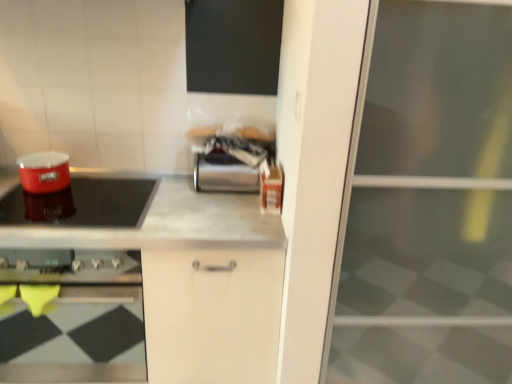
Measure the distance between point [196,325] and camera.

Point [196,325] is 5.15 feet from camera.

Identify the location of transparent glass screen door at right. This screenshot has height=384, width=512. (431, 203).

The image size is (512, 384). I want to click on shiny red pot at left, so click(x=81, y=204).

I want to click on matte black cooktop at left, so [x=77, y=340].

This screenshot has height=384, width=512. I want to click on satin silver canister at center, which ranks as the 2th appliance in left-to-right order, so click(230, 164).

Based on the photo, could you tell me if matte black cooktop at left is turned towards transparent glass screen door at right?

No, matte black cooktop at left is not facing towards transparent glass screen door at right.

Is matte black cooktop at left completely or partially outside of transparent glass screen door at right?

matte black cooktop at left is positioned outside transparent glass screen door at right.

Which of these two, matte black cooktop at left or transparent glass screen door at right, is wider?

transparent glass screen door at right is wider.

At what (x,y) coordinates should I click in order to perform the action: click on home appliance located on the left of transparent glass screen door at right. Please return your answer as a coordinate pair (x, y). Looking at the image, I should click on (77, 340).

The width and height of the screenshot is (512, 384). In order to click on appliance in front of the satin silver canister at center, which is the 1th appliance from right to left in this screenshot , I will do `click(44, 172)`.

Is satin silver canister at center, which is the 1th appliance from right to left, placed right next to matte red pot at left, which is the second appliance from right to left?

No.

Is satin silver canister at center, which is the 1th appliance from right to left, bigger or smaller than matte red pot at left, which ranks as the first appliance in left-to-right order?

Considering their sizes, satin silver canister at center, which is the 1th appliance from right to left, takes up more space than matte red pot at left, which ranks as the first appliance in left-to-right order.

How different are the orientations of satin silver canister at center, which ranks as the 2th appliance in left-to-right order, and matte red pot at left, which ranks as the first appliance in left-to-right order, in degrees?

The angular difference between satin silver canister at center, which ranks as the 2th appliance in left-to-right order, and matte red pot at left, which ranks as the first appliance in left-to-right order, is 0.00412 degrees.

Consider the image. Between matte red pot at left, which is the second appliance from right to left, and satin silver canister at center, which ranks as the 2th appliance in left-to-right order, which one is positioned in front?

matte red pot at left, which is the second appliance from right to left, is in front.

From a real-world perspective, is matte red pot at left, which ranks as the first appliance in left-to-right order, positioned over satin silver canister at center, which ranks as the 2th appliance in left-to-right order, based on gravity?

No, from a real-world perspective, matte red pot at left, which ranks as the first appliance in left-to-right order, is not on top of satin silver canister at center, which ranks as the 2th appliance in left-to-right order.

Would you consider matte red pot at left, which ranks as the first appliance in left-to-right order, to be distant from satin silver canister at center, which ranks as the 2th appliance in left-to-right order?

No, matte red pot at left, which ranks as the first appliance in left-to-right order, is not far from satin silver canister at center, which ranks as the 2th appliance in left-to-right order.

Does satin silver canister at center, which is the 1th appliance from right to left, appear on the left side of shiny red pot at left?

No, satin silver canister at center, which is the 1th appliance from right to left, is not to the left of shiny red pot at left.

Which point is more distant from viewer, (229, 153) or (131, 218)?

Positioned behind is point (229, 153).

From a real-world perspective, is satin silver canister at center, which ranks as the 2th appliance in left-to-right order, on top of shiny red pot at left?

Correct, in the physical world, satin silver canister at center, which ranks as the 2th appliance in left-to-right order, is higher than shiny red pot at left.

Is satin silver canister at center, which is the 1th appliance from right to left, beside shiny red pot at left?

No, satin silver canister at center, which is the 1th appliance from right to left, is not touching shiny red pot at left.

Consider the image. From a real-world perspective, is transparent glass screen door at right above or below matte black cooktop at left?

Clearly, from a real-world perspective, transparent glass screen door at right is above matte black cooktop at left.

From the image's perspective, which one is positioned higher, transparent glass screen door at right or matte black cooktop at left?

From the image's view, transparent glass screen door at right is above.

Which of these two, transparent glass screen door at right or matte black cooktop at left, is wider?

Wider between the two is transparent glass screen door at right.

Is matte black cooktop at left at the back of transparent glass screen door at right?

No, matte black cooktop at left is not at the back of transparent glass screen door at right.

How many degrees apart are the facing directions of shiny red pot at left and transparent glass screen door at right?

The angular difference between shiny red pot at left and transparent glass screen door at right is 0.367 degrees.

Which object is positioned more to the right, shiny red pot at left or transparent glass screen door at right?

transparent glass screen door at right.

Does shiny red pot at left turn towards transparent glass screen door at right?

No, shiny red pot at left is not oriented towards transparent glass screen door at right.

Is point (156, 181) farther from viewer compared to point (443, 185)?

Yes, it is behind point (443, 185).

Is matte black cooktop at left completely or partially outside of satin silver canister at center, which is the 1th appliance from right to left?

Absolutely, matte black cooktop at left is external to satin silver canister at center, which is the 1th appliance from right to left.

Which object is further away from the camera taking this photo, matte black cooktop at left or satin silver canister at center, which is the 1th appliance from right to left?

satin silver canister at center, which is the 1th appliance from right to left, is more distant.

Considering the relative sizes of matte black cooktop at left and satin silver canister at center, which is the 1th appliance from right to left, in the image provided, is matte black cooktop at left taller than satin silver canister at center, which is the 1th appliance from right to left,?

Indeed, matte black cooktop at left has a greater height compared to satin silver canister at center, which is the 1th appliance from right to left.

Is point (65, 352) in front of point (244, 152)?

That is False.

Locate an element on the screen. home appliance below the transparent glass screen door at right (from the image's perspective) is located at coordinates (77, 340).

Find the location of `appliance on the left of the satin silver canister at center, which ranks as the 2th appliance in left-to-right order`. appliance on the left of the satin silver canister at center, which ranks as the 2th appliance in left-to-right order is located at coordinates (44, 172).

Looking at the image, which one is located closer to shiny red pot at left, metallic gray countertop at center or matte red pot at left, which is the second appliance from right to left?

matte red pot at left, which is the second appliance from right to left.

Considering their positions, is satin silver canister at center, which is the 1th appliance from right to left, positioned further to shiny red pot at left than matte black cooktop at left?

matte black cooktop at left is positioned further to the anchor shiny red pot at left.

Looking at the image, which one is located further to transparent glass screen door at right, shiny red pot at left or matte red pot at left, which ranks as the first appliance in left-to-right order?

The object further to transparent glass screen door at right is matte red pot at left, which ranks as the first appliance in left-to-right order.

Based on their spatial positions, is matte black cooktop at left or matte red pot at left, which is the second appliance from right to left, further from shiny red pot at left?

The object further to shiny red pot at left is matte black cooktop at left.

From the image, which object appears to be nearer to satin silver canister at center, which is the 1th appliance from right to left, transparent glass screen door at right or shiny red pot at left?

Based on the image, shiny red pot at left appears to be nearer to satin silver canister at center, which is the 1th appliance from right to left.

Looking at the image, which one is located further to matte black cooktop at left, metallic gray countertop at center or transparent glass screen door at right?

Based on the image, transparent glass screen door at right appears to be further to matte black cooktop at left.

Considering their positions, is matte black cooktop at left positioned closer to transparent glass screen door at right than matte red pot at left, which ranks as the first appliance in left-to-right order?

matte black cooktop at left lies closer to transparent glass screen door at right than the other object.

Estimate the real-world distances between objects in this image. Which object is closer to metallic gray countertop at center, matte red pot at left, which is the second appliance from right to left, or transparent glass screen door at right?

transparent glass screen door at right.

Where is `countertop between matte black cooktop at left and satin silver canister at center, which is the 1th appliance from right to left, from left to right`? countertop between matte black cooktop at left and satin silver canister at center, which is the 1th appliance from right to left, from left to right is located at coordinates 195,281.

Locate an element on the screen. This screenshot has height=384, width=512. kitchen appliance situated between matte red pot at left, which is the second appliance from right to left, and transparent glass screen door at right from left to right is located at coordinates (81, 204).

Locate an element on the screen. The height and width of the screenshot is (384, 512). appliance situated between matte red pot at left, which ranks as the first appliance in left-to-right order, and transparent glass screen door at right from left to right is located at coordinates (230, 164).

Find the location of a particular element. countertop situated between matte red pot at left, which is the second appliance from right to left, and transparent glass screen door at right from left to right is located at coordinates (195, 281).